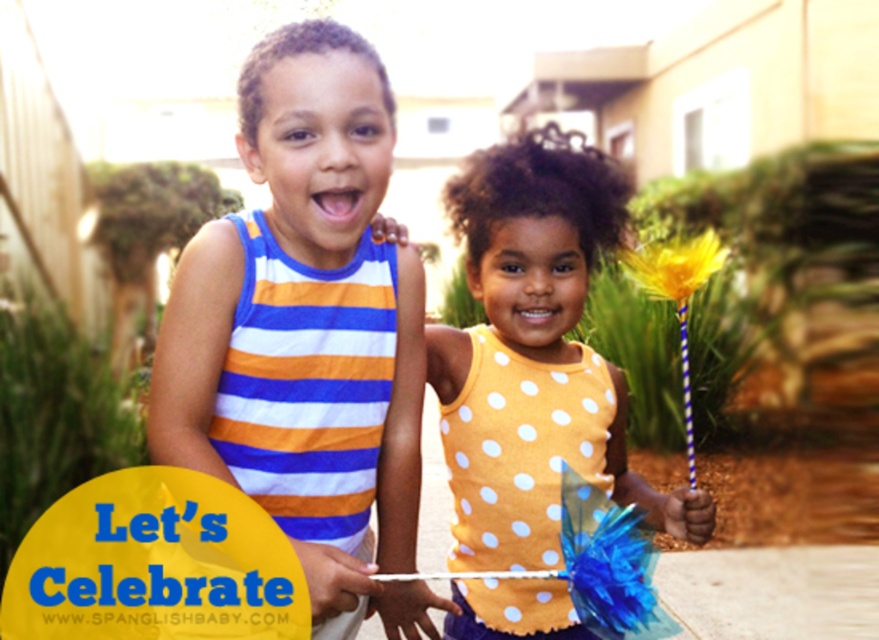
Question: Which of these objects is positioned farthest from the yellow paper flower at upper right?

Choices:
 (A) yellow dotted tank top at center
 (B) striped fabric tank top at left

Answer: (B)

Question: Is yellow dotted tank top at center wider than yellow paper flower at upper right?

Choices:
 (A) yes
 (B) no

Answer: (A)

Question: Which object is closer to the camera taking this photo?

Choices:
 (A) striped fabric tank top at left
 (B) yellow dotted tank top at center
 (C) yellow paper flower at upper right

Answer: (A)

Question: Is striped fabric tank top at left further to camera compared to yellow dotted tank top at center?

Choices:
 (A) yes
 (B) no

Answer: (B)

Question: Is yellow dotted tank top at center positioned in front of yellow paper flower at upper right?

Choices:
 (A) no
 (B) yes

Answer: (A)

Question: Which object is the closest to the yellow paper flower at upper right?

Choices:
 (A) yellow dotted tank top at center
 (B) striped fabric tank top at left

Answer: (A)